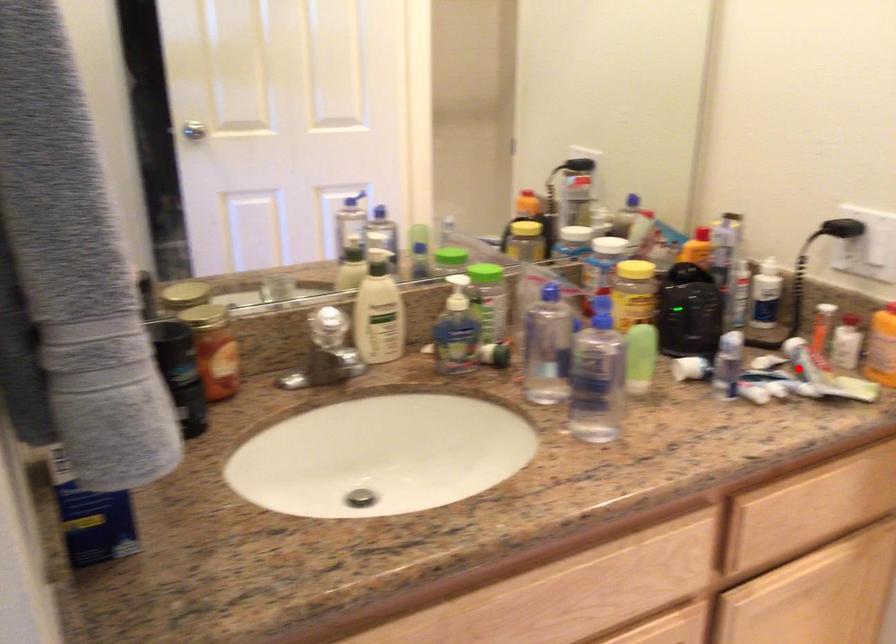
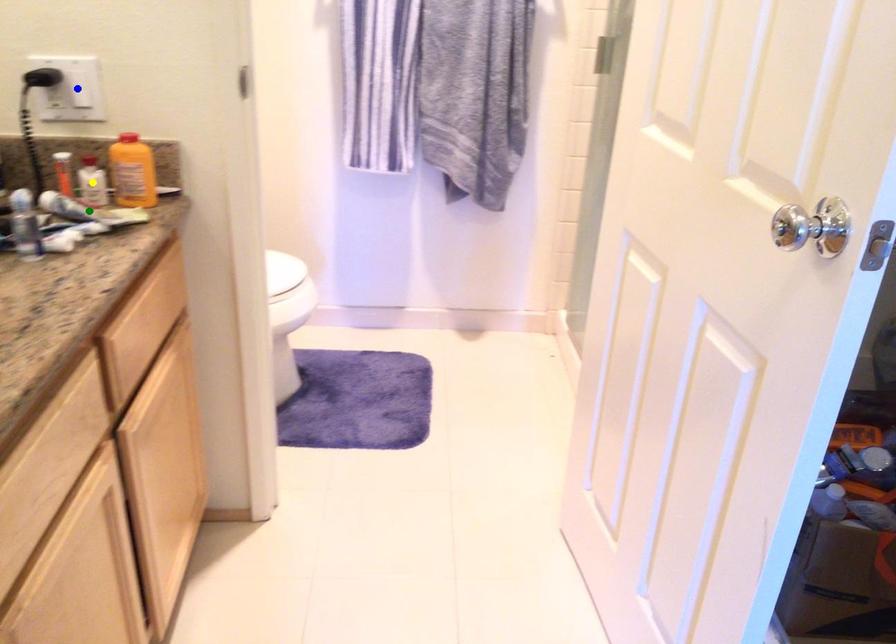
Question: I am providing you with two images of the same scene from different viewpoints. A red point is marked on the first image. You are given multiple points on the second image. Can you choose the point in image 2 that corresponds to the point in image 1?

Choices:
 (A) blue point
 (B) yellow point
 (C) green point

Answer: (C)